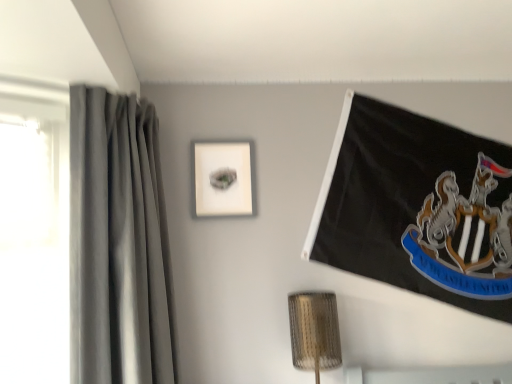
Question: Can you confirm if matte white picture frame at center is taller than gray fabric curtain at left?

Choices:
 (A) no
 (B) yes

Answer: (A)

Question: Can you confirm if matte white picture frame at center is bigger than gray fabric curtain at left?

Choices:
 (A) yes
 (B) no

Answer: (B)

Question: Is matte white picture frame at center at the left side of gray fabric curtain at left?

Choices:
 (A) yes
 (B) no

Answer: (B)

Question: Does matte white picture frame at center have a lesser height compared to gray fabric curtain at left?

Choices:
 (A) yes
 (B) no

Answer: (A)

Question: Can you see matte white picture frame at center touching gray fabric curtain at left?

Choices:
 (A) no
 (B) yes

Answer: (A)

Question: From a real-world perspective, is matte white picture frame at center located beneath gray fabric curtain at left?

Choices:
 (A) no
 (B) yes

Answer: (A)

Question: From the image's perspective, is gray fabric curtain at left beneath matte white picture frame at center?

Choices:
 (A) yes
 (B) no

Answer: (A)

Question: Does gray fabric curtain at left have a greater width compared to matte white picture frame at center?

Choices:
 (A) no
 (B) yes

Answer: (B)

Question: Is gray fabric curtain at left facing away from matte white picture frame at center?

Choices:
 (A) yes
 (B) no

Answer: (B)

Question: Considering the relative positions of gray fabric curtain at left and matte white picture frame at center in the image provided, is gray fabric curtain at left to the left of matte white picture frame at center from the viewer's perspective?

Choices:
 (A) no
 (B) yes

Answer: (B)

Question: Would you say gray fabric curtain at left is outside matte white picture frame at center?

Choices:
 (A) yes
 (B) no

Answer: (A)

Question: Considering the relative sizes of gray fabric curtain at left and matte white picture frame at center in the image provided, is gray fabric curtain at left thinner than matte white picture frame at center?

Choices:
 (A) no
 (B) yes

Answer: (A)

Question: Looking at their shapes, would you say matte white picture frame at center is wider or thinner than gray fabric curtain at left?

Choices:
 (A) wide
 (B) thin

Answer: (B)